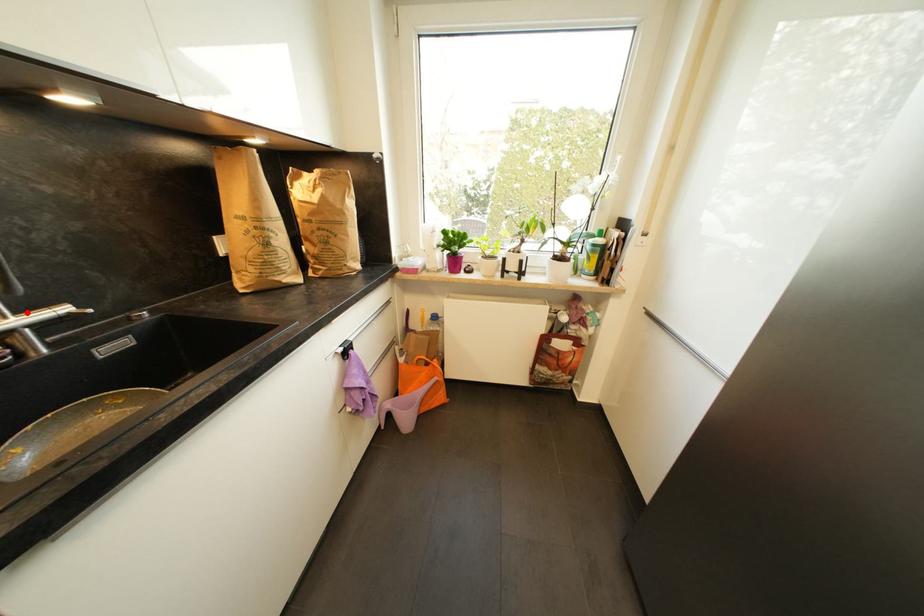
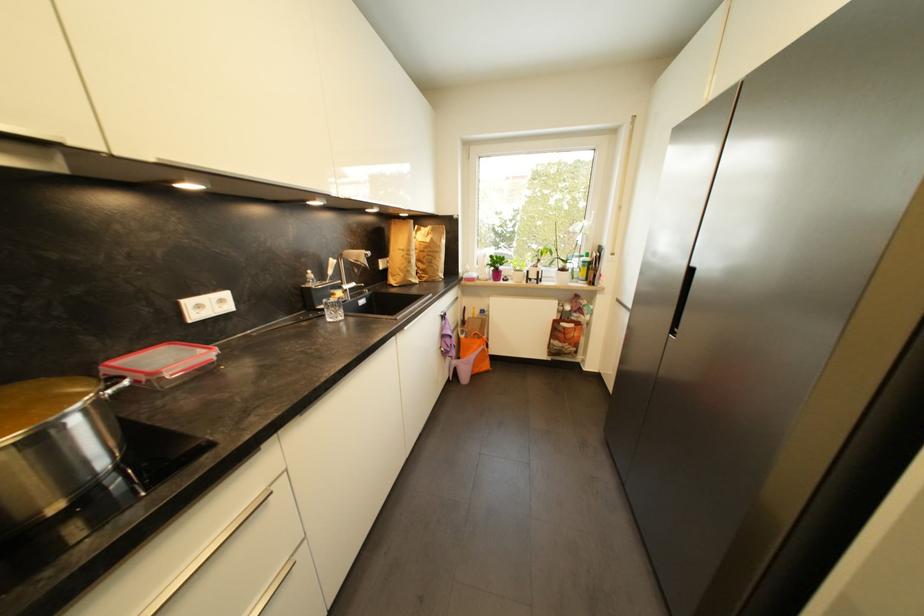
Question: I am providing you with two images of the same scene from different viewpoints. In image1, a red point is highlighted. Considering the same 3D point in image2, which of the following is correct?

Choices:
 (A) It is closer
 (B) It is farther

Answer: (A)